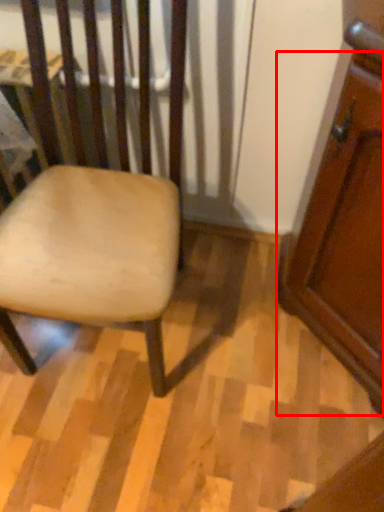
Question: In this image, where is screen door (annotated by the red box) located relative to chair?

Choices:
 (A) left
 (B) right

Answer: (B)